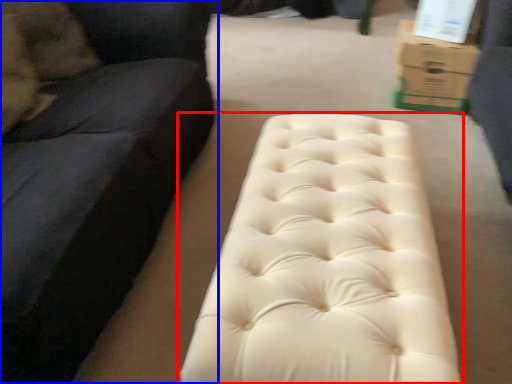
Question: Which object is further to the camera taking this photo, furniture (highlighted by a red box) or studio couch (highlighted by a blue box)?

Choices:
 (A) furniture
 (B) studio couch

Answer: (A)